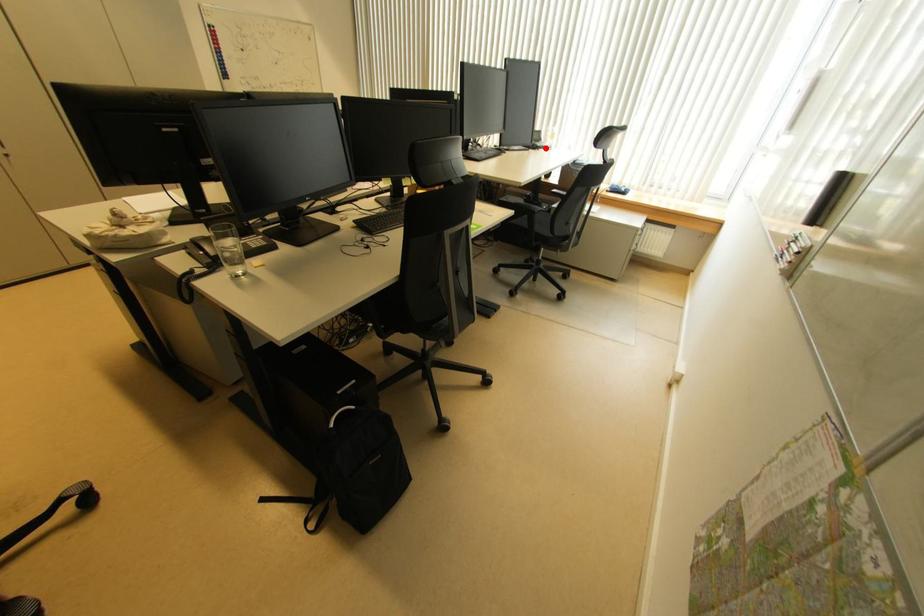
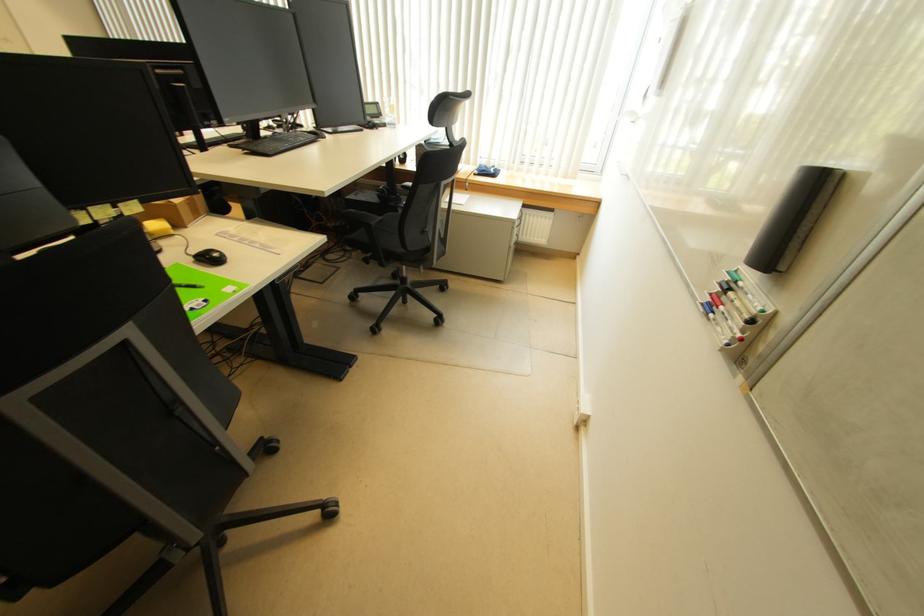
Locate, in the second image, the point that corresponds to the highlighted location in the first image.

(386, 124)